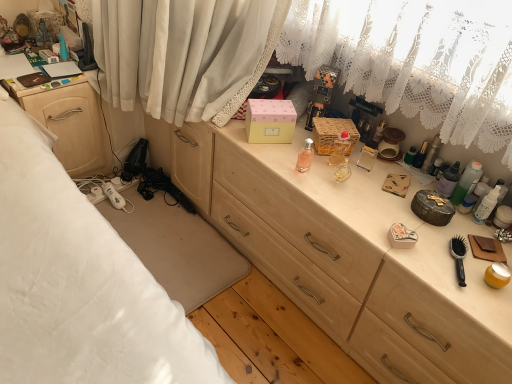
Where is `vacant area that is in front of translucent glass perfume at center, acting as the second toiletry starting from the left`? The image size is (512, 384). vacant area that is in front of translucent glass perfume at center, acting as the second toiletry starting from the left is located at coordinates (336, 197).